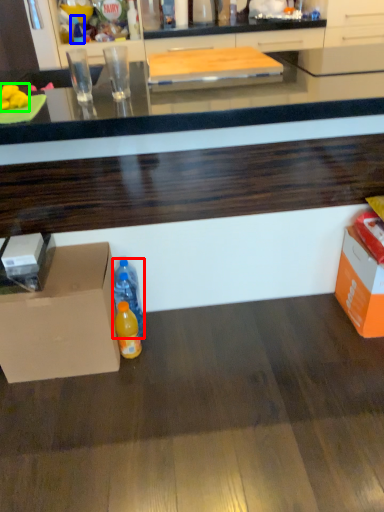
Question: Estimate the real-world distances between objects in this image. Which object is farther from bottle (highlighted by a red box), bottle (highlighted by a blue box) or food (highlighted by a green box)?

Choices:
 (A) bottle
 (B) food

Answer: (A)